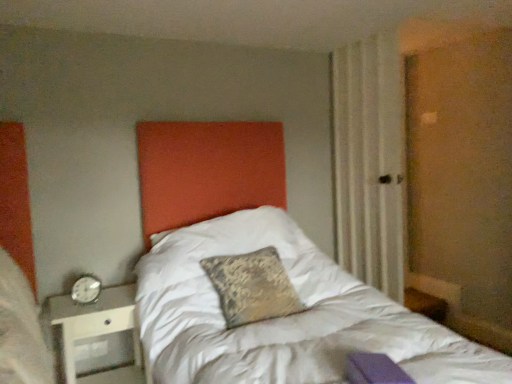
Question: Would you say metallic silver nightstand at lower left contains silver metallic alarm clock at left?

Choices:
 (A) no
 (B) yes

Answer: (A)

Question: Does metallic silver nightstand at lower left have a smaller size compared to silver metallic alarm clock at left?

Choices:
 (A) no
 (B) yes

Answer: (A)

Question: From a real-world perspective, is metallic silver nightstand at lower left positioned over silver metallic alarm clock at left based on gravity?

Choices:
 (A) yes
 (B) no

Answer: (B)

Question: From the image's perspective, is metallic silver nightstand at lower left below silver metallic alarm clock at left?

Choices:
 (A) yes
 (B) no

Answer: (A)

Question: Is metallic silver nightstand at lower left oriented away from silver metallic alarm clock at left?

Choices:
 (A) no
 (B) yes

Answer: (A)

Question: Considering the relative positions of beige textured curtain at right and metallic silver nightstand at lower left in the image provided, is beige textured curtain at right to the left or to the right of metallic silver nightstand at lower left?

Choices:
 (A) left
 (B) right

Answer: (B)

Question: Is beige textured curtain at right bigger or smaller than metallic silver nightstand at lower left?

Choices:
 (A) big
 (B) small

Answer: (A)

Question: Is point pos(337,157) positioned closer to the camera than point pos(67,370)?

Choices:
 (A) farther
 (B) closer

Answer: (A)

Question: Is beige textured curtain at right in front of or behind metallic silver nightstand at lower left in the image?

Choices:
 (A) behind
 (B) front

Answer: (A)

Question: From their relative heights in the image, would you say beige textured curtain at right is taller or shorter than silver metallic alarm clock at left?

Choices:
 (A) tall
 (B) short

Answer: (A)

Question: Visually, is beige textured curtain at right positioned to the left or to the right of silver metallic alarm clock at left?

Choices:
 (A) right
 (B) left

Answer: (A)

Question: Is point (382, 135) closer or farther from the camera than point (88, 284)?

Choices:
 (A) farther
 (B) closer

Answer: (A)

Question: From the image's perspective, is beige textured curtain at right positioned above or below silver metallic alarm clock at left?

Choices:
 (A) above
 (B) below

Answer: (A)

Question: Relative to silver metallic alarm clock at left, is metallic silver nightstand at lower left in front or behind?

Choices:
 (A) behind
 (B) front

Answer: (B)

Question: In the image, is metallic silver nightstand at lower left on the left side or the right side of silver metallic alarm clock at left?

Choices:
 (A) right
 (B) left

Answer: (A)